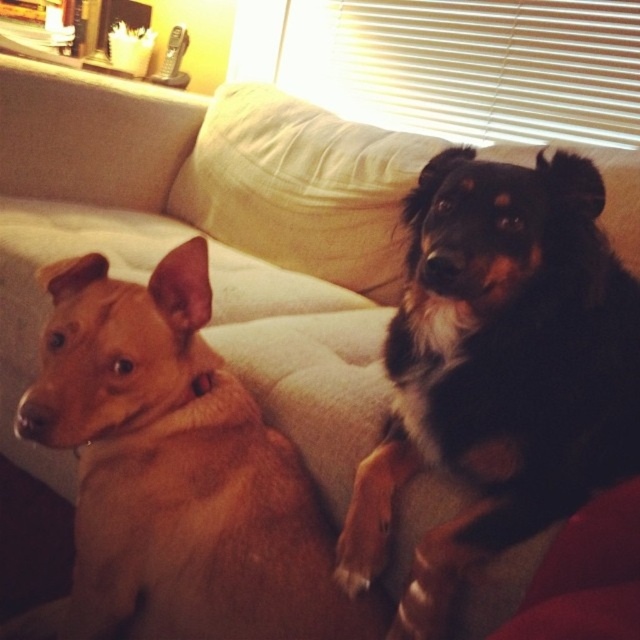
You are a pet sitter who needs to place a 25 inch long toy between the black fur dog at center and the beige fabric pillow at upper center. Can the toy fit in the space between them?

The distance between the black fur dog at center and the beige fabric pillow at upper center is 25.45 inches. Since the toy is 25 inches long, it can fit in the space between them as the available space is slightly larger than the toy.

You are trying to decide whether to place a new toy between the black fur dog at center and the beige fabric pillow at upper center. Based on their sizes, which one do you think you should place the toy closer to?

The black fur dog at center is smaller than the beige fabric pillow at upper center, so you should place the toy closer to the beige fabric pillow at upper center to ensure it is visible and accessible.